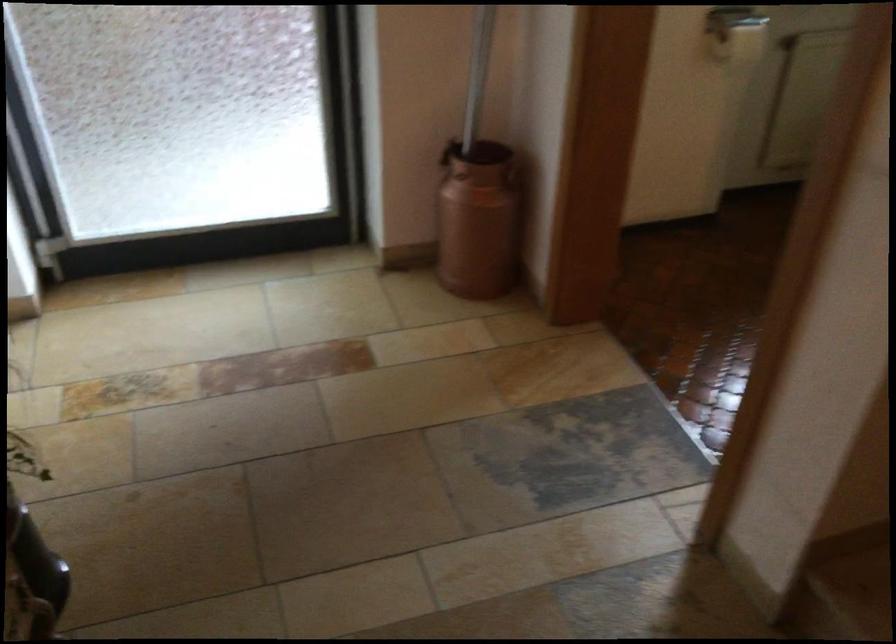
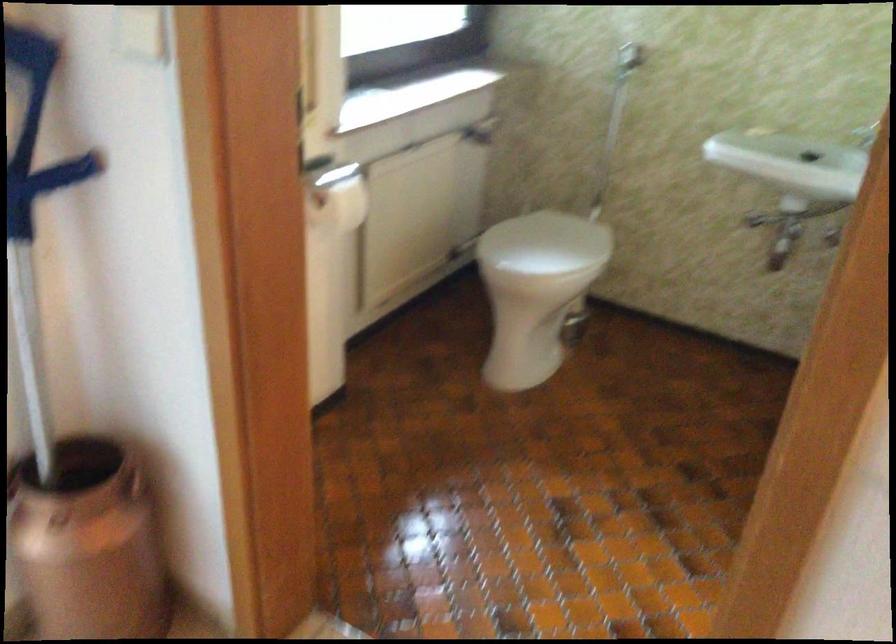
Question: Based on the continuous images, in which direction is the camera rotating? Reply with the corresponding letter.

Choices:
 (A) Left
 (B) Right
 (C) Up
 (D) Down

Answer: (B)